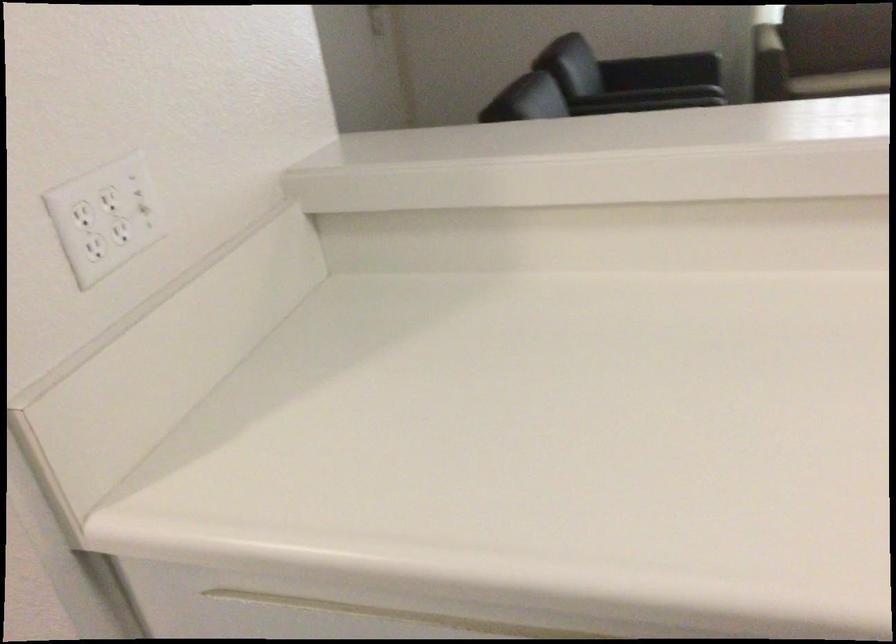
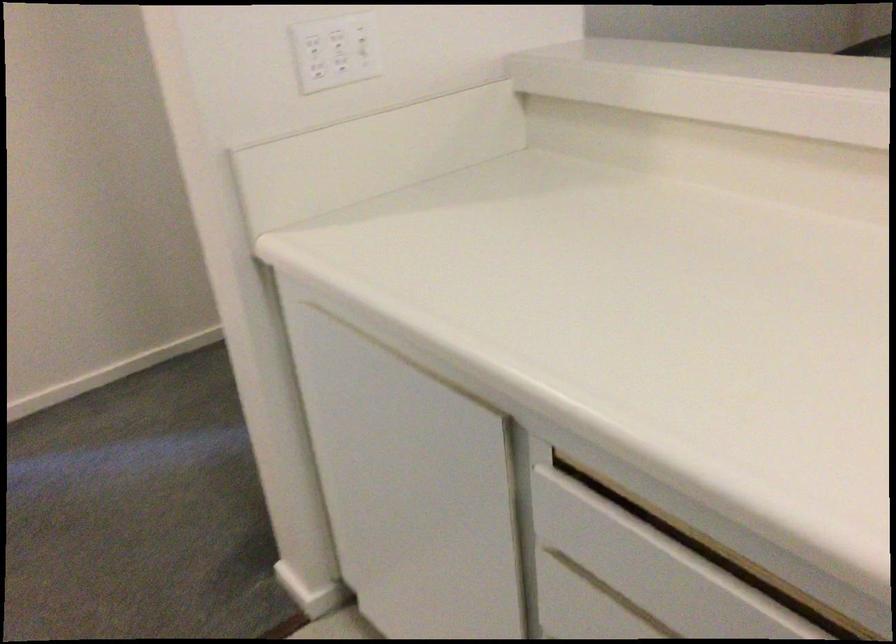
Locate, in the second image, the point that corresponds to point 133,234 in the first image.

(349, 67)